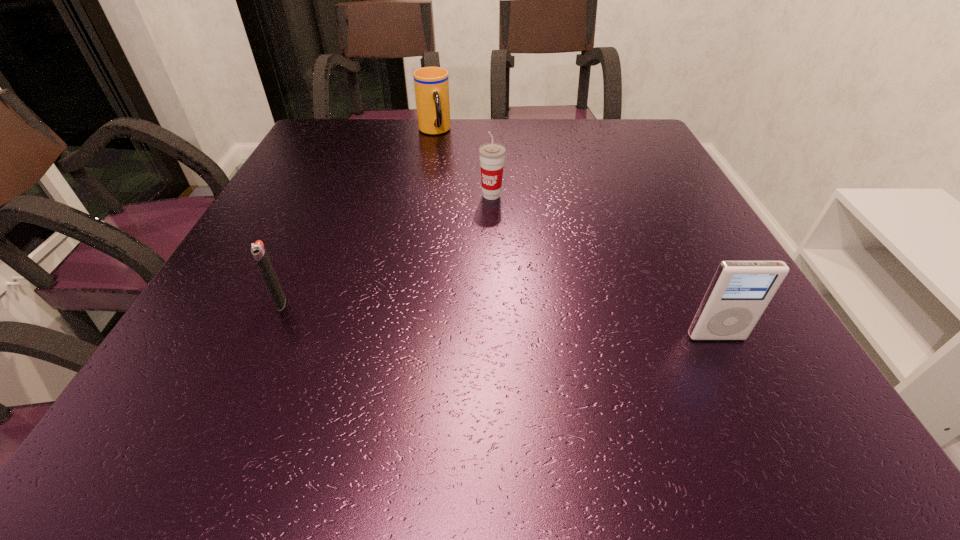
Locate an element on the screen. The image size is (960, 540). free location at the far edge of the desktop is located at coordinates (499, 137).

In order to click on vacant space at the near edge of the desktop in this screenshot , I will do `click(343, 341)`.

In the image, there is a desktop. At what (x,y) coordinates should I click in order to perform the action: click on vacant region at the right edge. Please return your answer as a coordinate pair (x, y). This screenshot has height=540, width=960. Looking at the image, I should click on (657, 160).

In the image, there is a desktop. Where is `vacant space at the far left corner`? vacant space at the far left corner is located at coordinates (356, 155).

Where is `vacant area at the near left corner`? The height and width of the screenshot is (540, 960). vacant area at the near left corner is located at coordinates (228, 335).

Locate an element on the screen. The width and height of the screenshot is (960, 540). free space at the far right corner is located at coordinates (633, 124).

Where is `vacant area that lies between the second nearest object and the farther cup`? Image resolution: width=960 pixels, height=540 pixels. vacant area that lies between the second nearest object and the farther cup is located at coordinates (357, 217).

Locate an element on the screen. The image size is (960, 540). free spot between the left cup and the shortest object is located at coordinates (357, 217).

Find the location of a particular element. vacant space in between the third nearest object and the iPod is located at coordinates (604, 266).

Identify the location of empty location between the nearer cup and the iPod. The height and width of the screenshot is (540, 960). (604, 266).